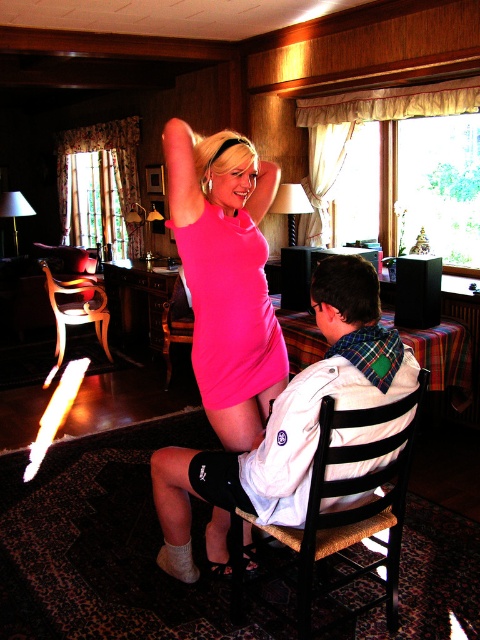
What is the color and texture of the dress located at the coordinates point (227, 275)?

The dress at point (227, 275) is pink and has a matte texture.

You are standing in the room and see two points marked in the image. If you want to reach point (108, 312) first, should you walk towards point (323, 502) first or the other way around?

Point (323, 502) is in front of point (108, 312). To reach point (108, 312) first, you should walk towards it directly rather than going through point (323, 502) first.